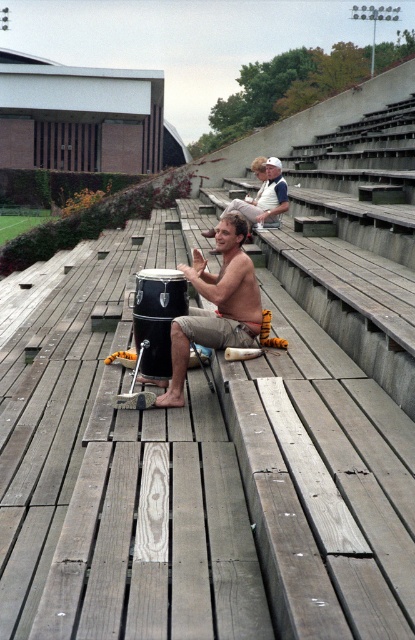
You are a spectator at the event and want to take a photo of both the shiny black drum at center and the shiny silver drum at center. Which drum should you position to your left side in the camera frame to capture both correctly?

You should position the shiny black drum at center to your left side in the camera frame because it is already located to the left of the shiny silver drum at center in the scene.

You are a stagehand setting up equipment for a performance. You have two drums in front of you, the shiny black drum at center and the shiny silver drum at center. Which drum should you place on the smaller stand if you know the stand can only accommodate a drum no larger than the smaller of the two?

You should place the shiny black drum at center on the smaller stand because it is smaller than the shiny silver drum at center, making it compatible with the stand.

You are a spectator at the stadium and want to take a photo of both the shiny black drum at center and the shiny silver drum at center. Which drum should you focus on first to ensure both are in the frame?

You should focus on the shiny black drum at center first because it is in front of the shiny silver drum at center, so positioning the camera to include both would require starting with the closer one.